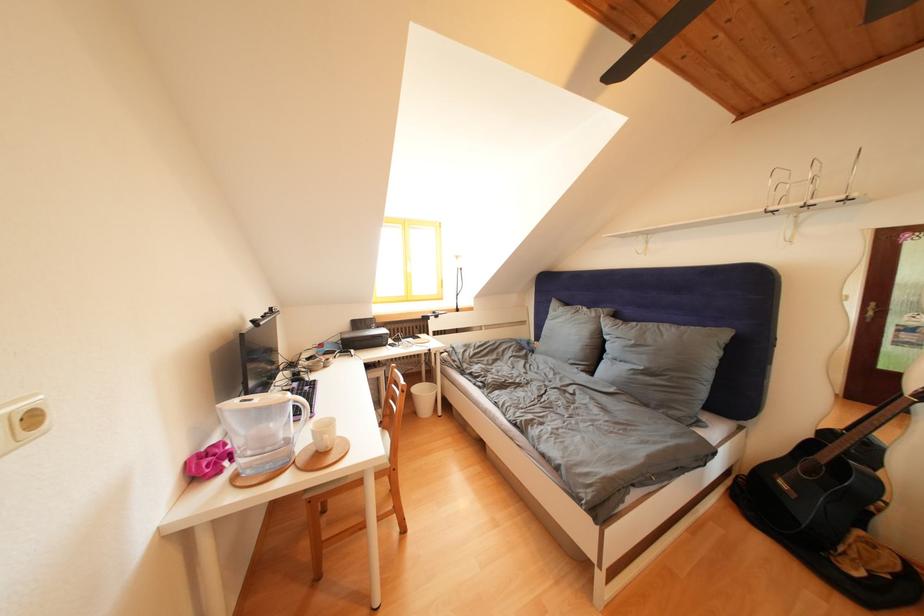
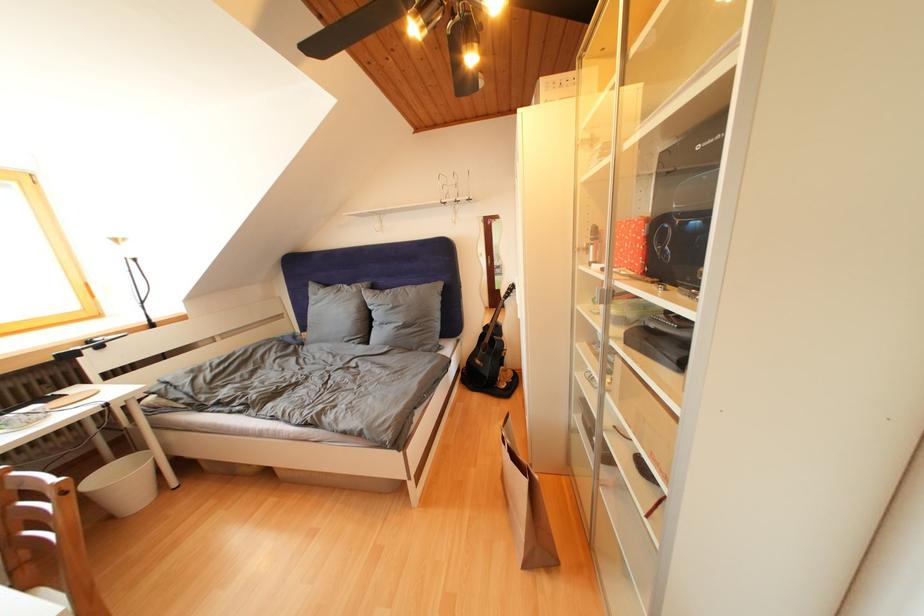
Question: The camera is either moving clockwise (left) or counter-clockwise (right) around the object. The first image is from the beginning of the video and the second image is from the end. Is the camera moving left or right when shooting the video?

Choices:
 (A) Left
 (B) Right

Answer: (A)